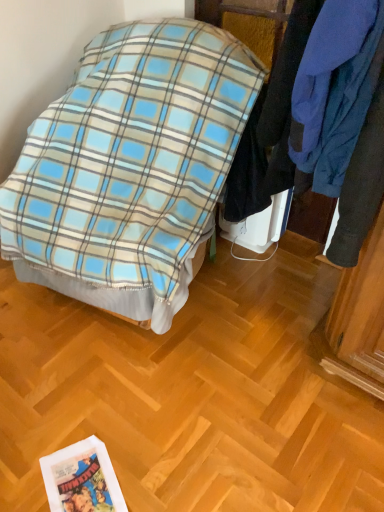
Question: Based on their sizes in the image, would you say blue plaid blanket at center is bigger or smaller than blue fleece jacket at upper right?

Choices:
 (A) big
 (B) small

Answer: (A)

Question: Is blue plaid blanket at center taller or shorter than blue fleece jacket at upper right?

Choices:
 (A) tall
 (B) short

Answer: (A)

Question: From a real-world perspective, is blue plaid blanket at center above or below blue fleece jacket at upper right?

Choices:
 (A) above
 (B) below

Answer: (B)

Question: Relative to blue plaid blanket at center, is blue fleece jacket at upper right in front or behind?

Choices:
 (A) behind
 (B) front

Answer: (B)

Question: Is blue fleece jacket at upper right wider or thinner than blue plaid blanket at center?

Choices:
 (A) thin
 (B) wide

Answer: (A)

Question: Based on their sizes in the image, would you say blue fleece jacket at upper right is bigger or smaller than blue plaid blanket at center?

Choices:
 (A) big
 (B) small

Answer: (B)

Question: Is blue fleece jacket at upper right situated inside blue plaid blanket at center or outside?

Choices:
 (A) outside
 (B) inside

Answer: (A)